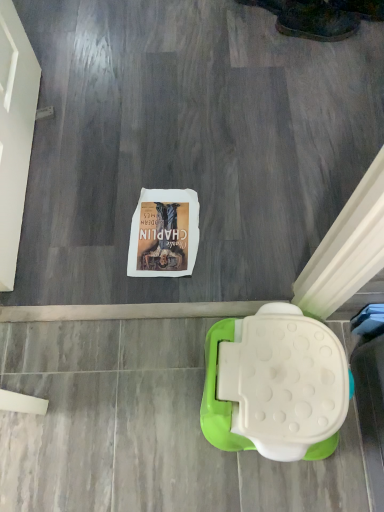
You are a GUI agent. You are given a task and a screenshot of the screen. Output one action in this format:
    pyautogui.click(x=<x>, y=<y>)
    Task: Click on the vacant area situated to the left side of leather boot at upper right
    The width and height of the screenshot is (384, 512).
    Given the screenshot: What is the action you would take?
    pyautogui.click(x=251, y=38)